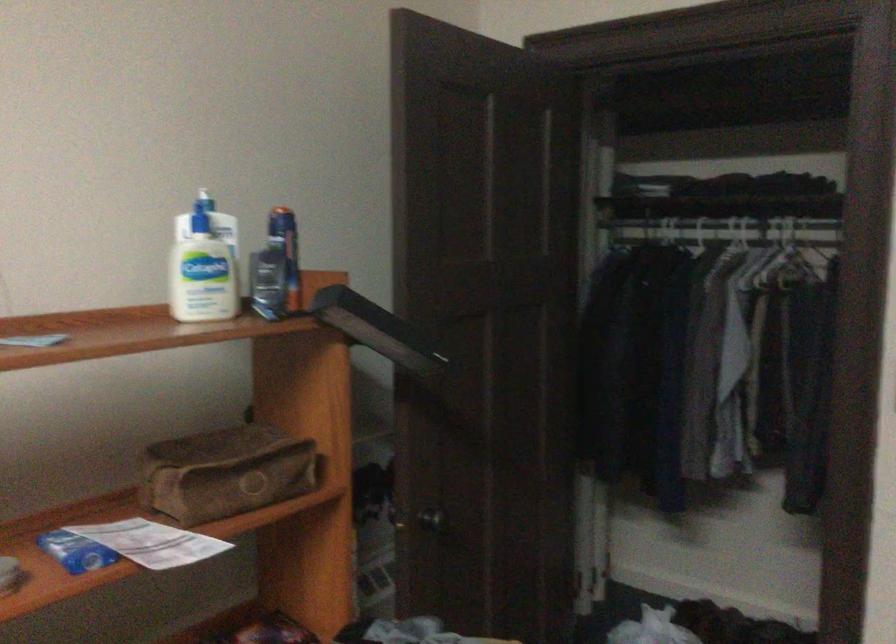
I want to click on blue pump top, so click(203, 265).